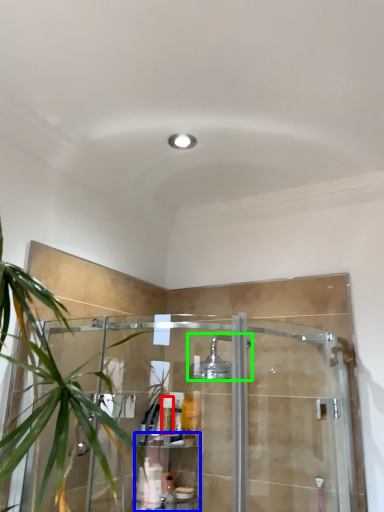
Question: Which object is positioned closest to toiletry (highlighted by a red box)? Select from shelf (highlighted by a blue box) and shower (highlighted by a green box).

Choices:
 (A) shelf
 (B) shower

Answer: (A)